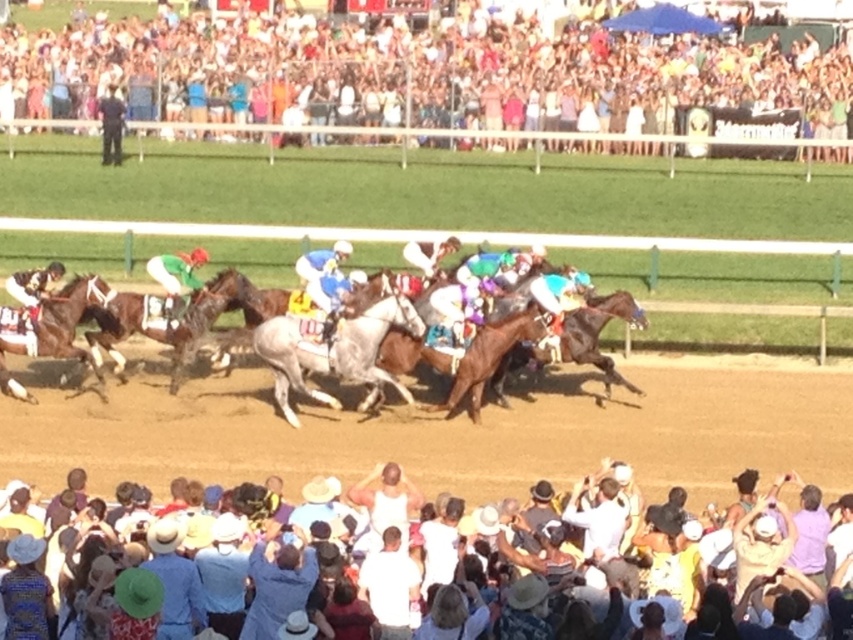
What do you see at coordinates (389, 586) in the screenshot? I see `white cotton shirt at center` at bounding box center [389, 586].

Is white cotton shirt at center to the left of white cotton crowd at lower center from the viewer's perspective?

Correct, you'll find white cotton shirt at center to the left of white cotton crowd at lower center.

Identify the location of white cotton shirt at center. (389, 586).

The image size is (853, 640). I want to click on white cotton shirt at center, so click(389, 586).

Who is positioned more to the right, white cotton shirt at center or white tank top at center?

Positioned to the right is white cotton shirt at center.

Who is shorter, white cotton shirt at center or white tank top at center?

With less height is white tank top at center.

In order to click on white cotton shirt at center in this screenshot , I will do `click(389, 586)`.

Is point (666, 36) closer to viewer compared to point (711, 486)?

No, (666, 36) is further to viewer.

Can you confirm if multicolored fabric crowd at upper center is positioned to the left of white cotton crowd at lower center?

Yes, multicolored fabric crowd at upper center is to the left of white cotton crowd at lower center.

Find the location of a particular element. This screenshot has width=853, height=640. multicolored fabric crowd at upper center is located at coordinates (439, 81).

In order to click on multicolored fabric crowd at upper center in this screenshot , I will do `click(439, 81)`.